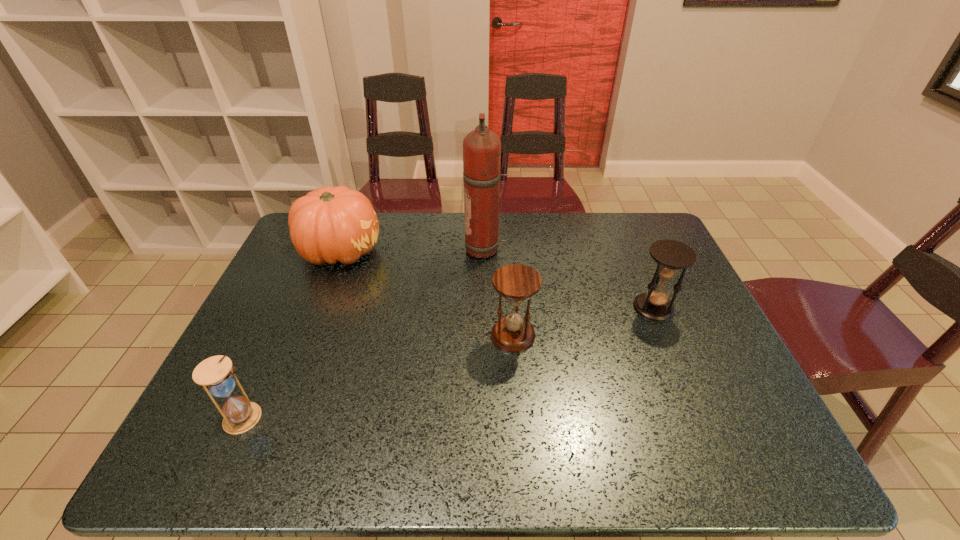
The height and width of the screenshot is (540, 960). I want to click on the tallest object, so click(481, 147).

Find the location of a particular element. The image size is (960, 540). pumpkin is located at coordinates (330, 224).

Image resolution: width=960 pixels, height=540 pixels. In order to click on the rightmost object in this screenshot , I will do `click(671, 256)`.

I want to click on the second hourglass from left to right, so click(515, 282).

Identify the location of the nearest object. (215, 374).

The width and height of the screenshot is (960, 540). In order to click on the leftmost hourglass in this screenshot , I will do `click(215, 374)`.

Identify the location of blank area located 0.060m on the side of the tallest object with the label and nozzle. (446, 250).

The height and width of the screenshot is (540, 960). Identify the location of vacant position located 0.370m on the side of the tallest object with the label and nozzle. (349, 250).

Where is `free space located 0.060m on the side of the tallest object with the label and nozzle`? free space located 0.060m on the side of the tallest object with the label and nozzle is located at coordinates (446, 250).

Identify the location of vacant space located on the carved face of the pumpkin. This screenshot has width=960, height=540. (423, 251).